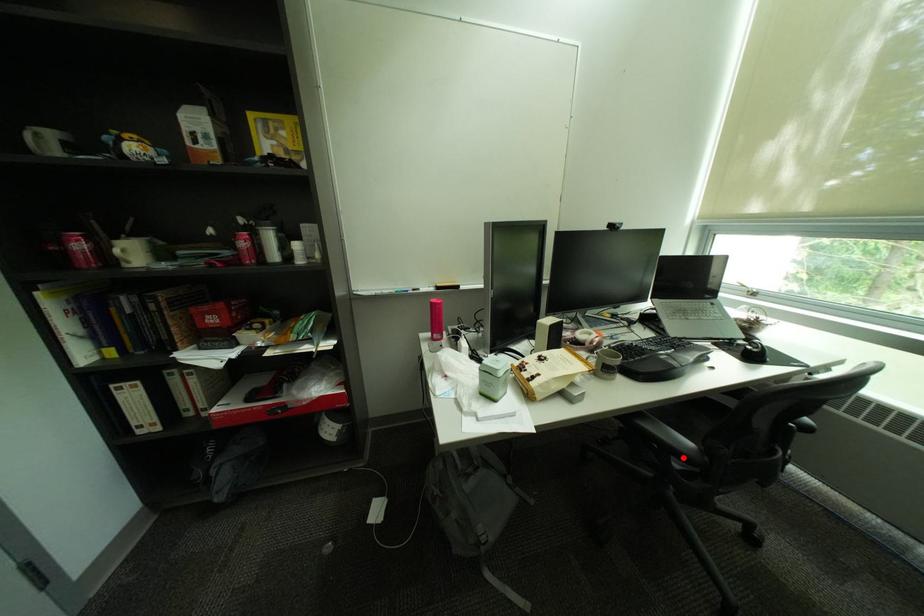
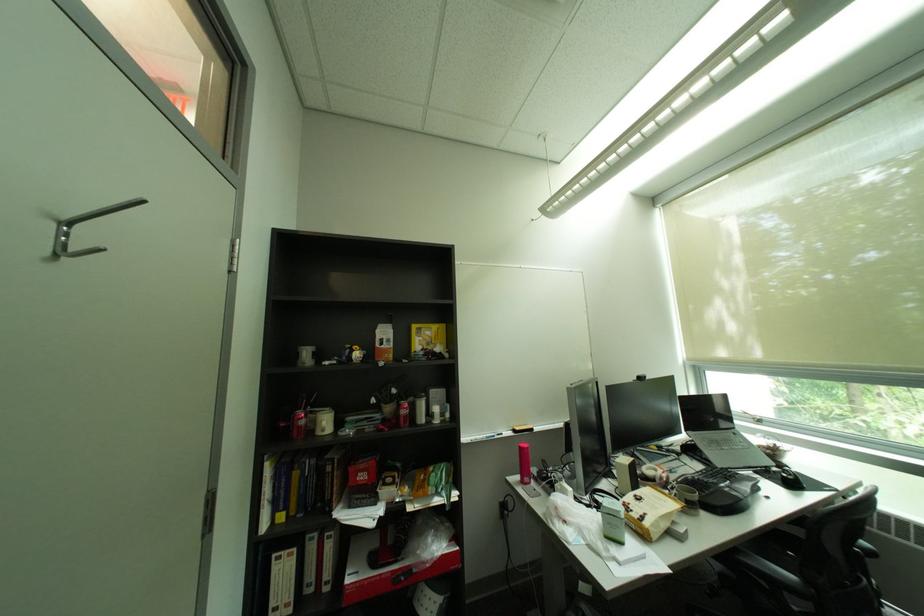
Question: A red point is marked in image1. In image2, is the corresponding 3D point closer to the camera or farther? Reply with the corresponding letter.

Choices:
 (A) The corresponding 3D point is closer.
 (B) The corresponding 3D point is farther.

Answer: (A)